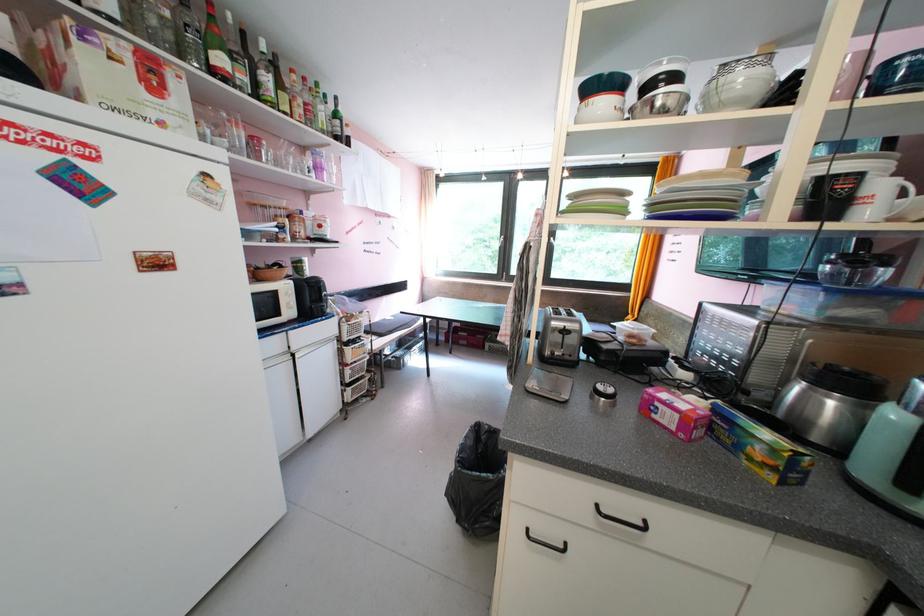
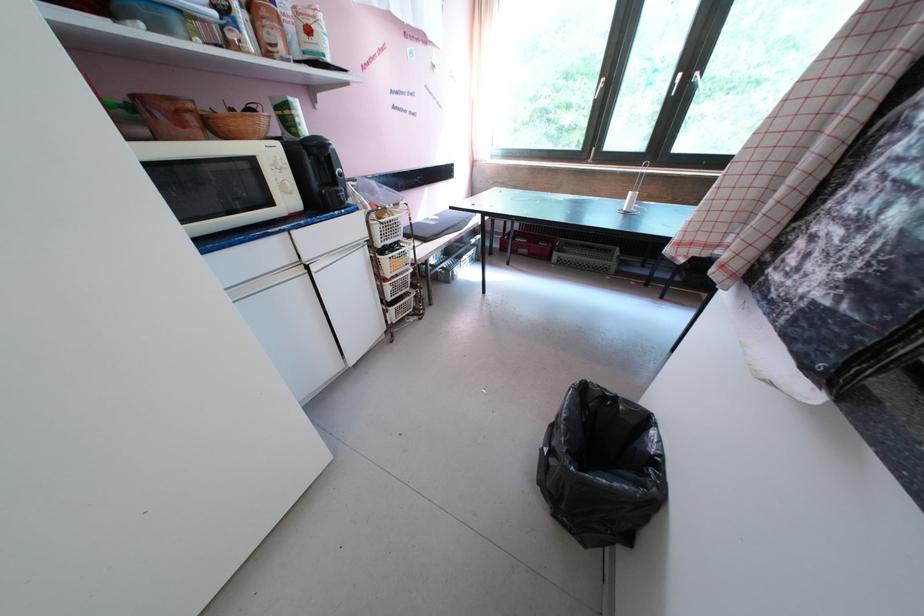
What movement of the cameraman would produce the second image?

The cameraman walked toward left, forward.